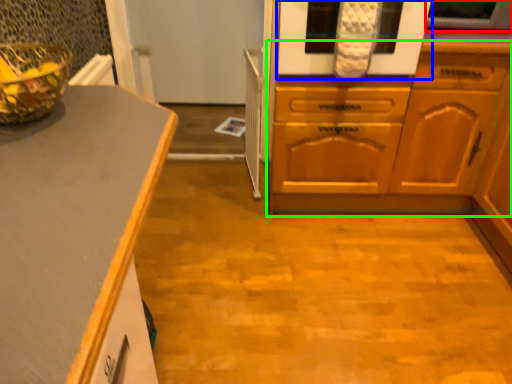
Question: Estimate the real-world distances between objects in this image. Which object is closer to appliance (highlighted by a red box), oven (highlighted by a blue box) or cabinetry (highlighted by a green box)?

Choices:
 (A) oven
 (B) cabinetry

Answer: (A)